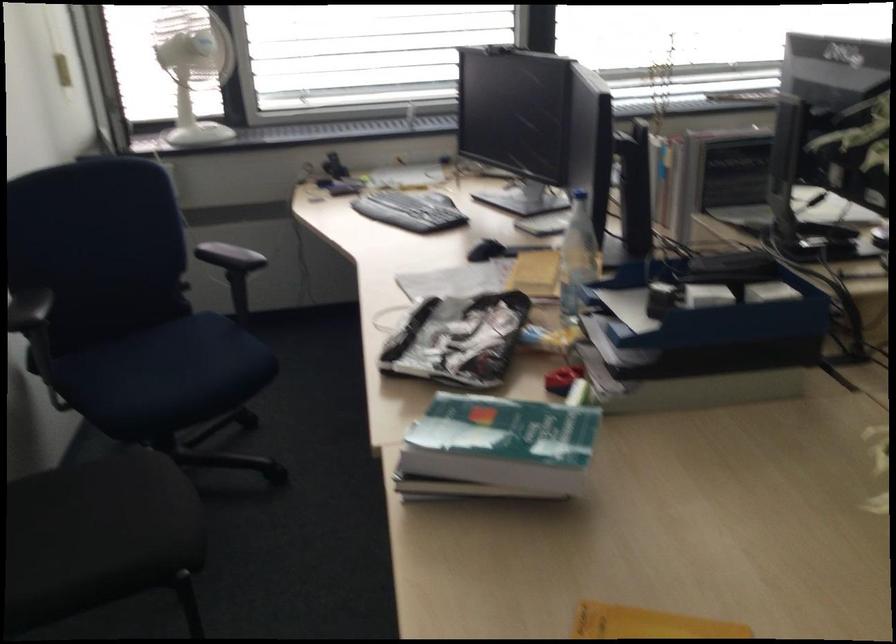
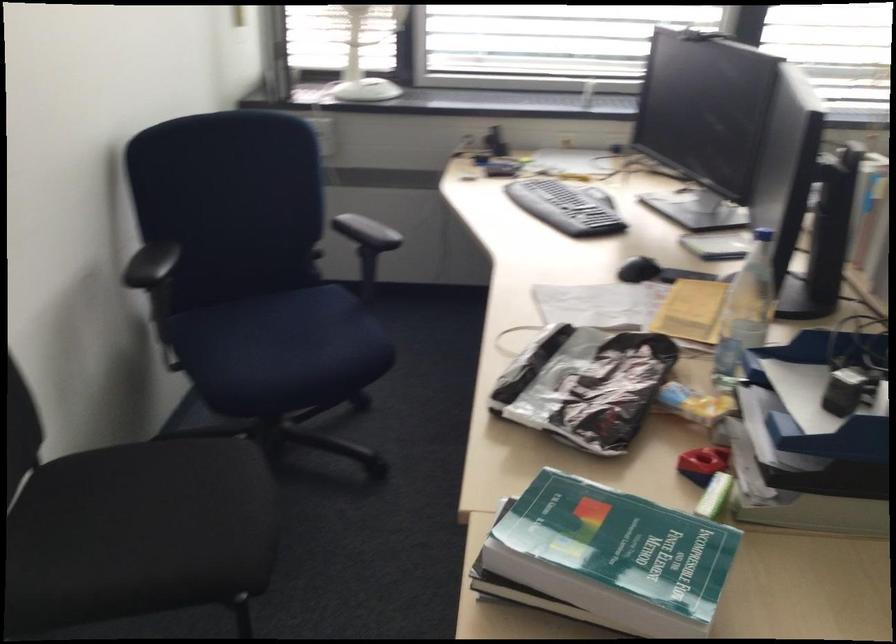
In the second image, find the point that corresponds to [79,518] in the first image.

(157, 500)